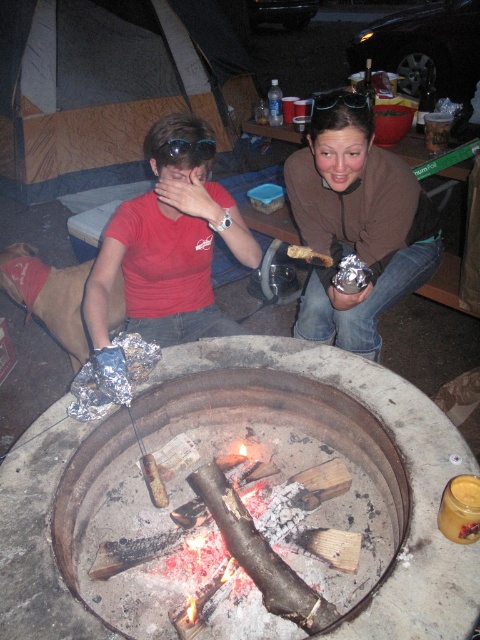
Measure the distance from charcoal gray concrete fire pit at center to matte red shirt at center.

charcoal gray concrete fire pit at center is 29.70 inches from matte red shirt at center.

Consider the image. Is charcoal gray concrete fire pit at center taller than matte red shirt at center?

→ No.

Describe the element at coordinates (294, 460) in the screenshot. I see `charcoal gray concrete fire pit at center` at that location.

Where is `charcoal gray concrete fire pit at center`? charcoal gray concrete fire pit at center is located at coordinates (294, 460).

The height and width of the screenshot is (640, 480). What do you see at coordinates (358, 227) in the screenshot?
I see `matte red shirt at center` at bounding box center [358, 227].

Can you confirm if matte red shirt at center is thinner than matte red shirt at left?

No, matte red shirt at center is not thinner than matte red shirt at left.

Measure the distance between matte red shirt at center and camera.

matte red shirt at center is 1.89 meters from camera.

Where is `matte red shirt at center`? matte red shirt at center is located at coordinates (358, 227).

Is matte red shirt at center further to camera compared to matte brown sweater at center?

Yes, matte red shirt at center is further from the viewer.

Does matte red shirt at center appear under matte brown sweater at center?

Indeed, matte red shirt at center is positioned under matte brown sweater at center.

Does point (233, 234) come behind point (327, 129)?

Yes.

Locate an element on the screen. Image resolution: width=480 pixels, height=640 pixels. matte red shirt at center is located at coordinates (358, 227).